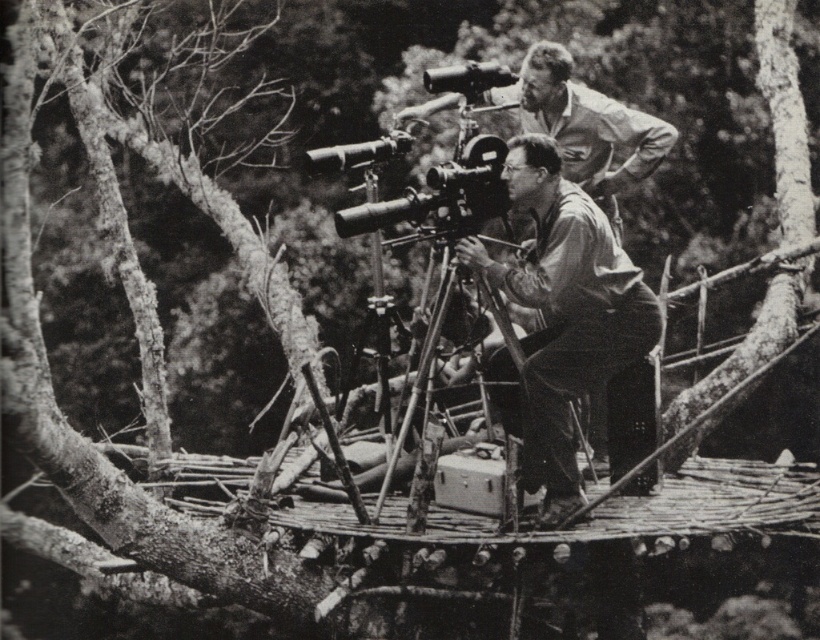
Question: Is matte black camera at center bigger than metallic tripod at center?

Choices:
 (A) no
 (B) yes

Answer: (B)

Question: In this image, where is matte black camera at center located relative to metallic tripod at center?

Choices:
 (A) right
 (B) left

Answer: (A)

Question: Is matte black camera at center in front of metallic tripod at center?

Choices:
 (A) yes
 (B) no

Answer: (A)

Question: Which object appears farthest from the camera in this image?

Choices:
 (A) matte black camera at center
 (B) metallic tripod at center

Answer: (B)

Question: Which point is closer to the camera taking this photo?

Choices:
 (A) (572, 189)
 (B) (481, 284)

Answer: (A)